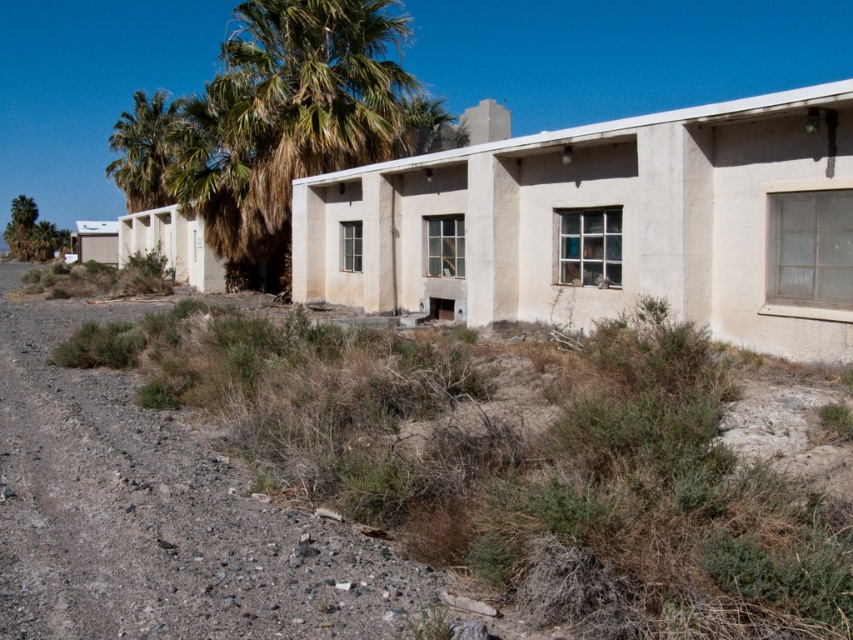
Question: From the image, what is the correct spatial relationship of dusty gravel path at lower left in relation to green leafy palm tree at upper left?

Choices:
 (A) left
 (B) right

Answer: (B)

Question: Which point is closer to the camera taking this photo?

Choices:
 (A) (144, 188)
 (B) (51, 385)

Answer: (B)

Question: Can you confirm if dusty gravel path at lower left is positioned to the right of green leafy palm tree at upper left?

Choices:
 (A) yes
 (B) no

Answer: (A)

Question: Is dusty gravel path at lower left to the left of green leafy palm tree at upper left from the viewer's perspective?

Choices:
 (A) no
 (B) yes

Answer: (A)